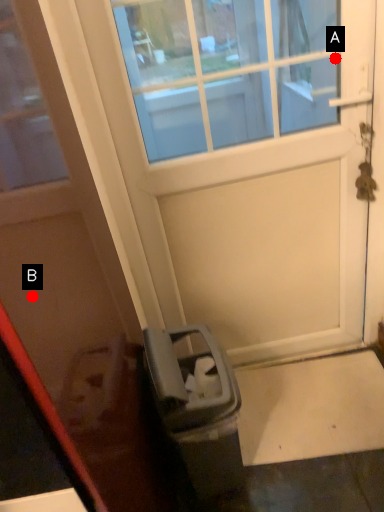
Question: Two points are circled on the image, labeled by A and B beside each circle. Which point is farther to the camera?

Choices:
 (A) A is further
 (B) B is further

Answer: (A)